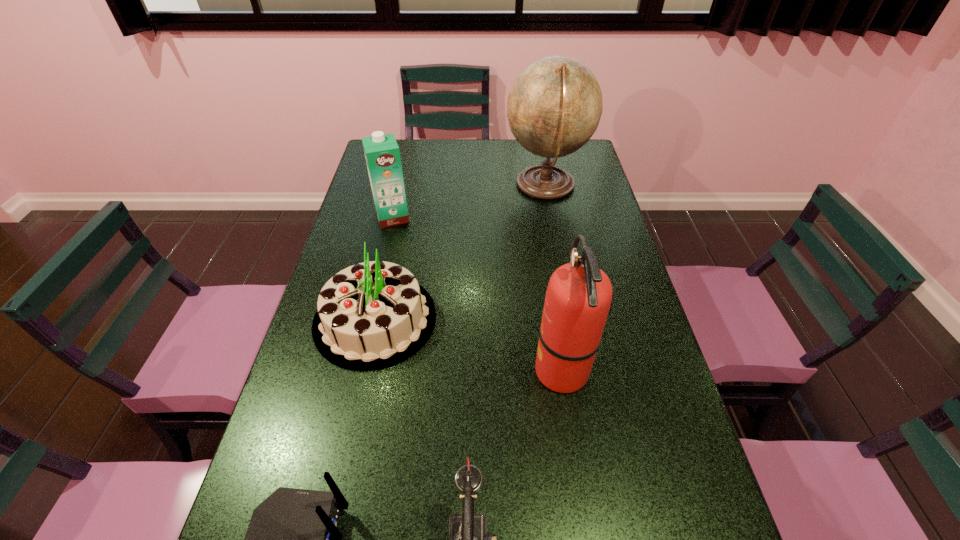
Where is `globe`? This screenshot has height=540, width=960. globe is located at coordinates (554, 107).

Locate an element on the screen. Image resolution: width=960 pixels, height=540 pixels. fire extinguisher is located at coordinates (578, 297).

This screenshot has width=960, height=540. In order to click on the third tallest object in this screenshot , I will do `click(382, 154)`.

Locate an element on the screen. The image size is (960, 540). birthday cake is located at coordinates (370, 316).

Where is `free location located on the front-facing side of the globe`? This screenshot has height=540, width=960. free location located on the front-facing side of the globe is located at coordinates (466, 185).

At what (x,y) coordinates should I click in order to perform the action: click on vacant space located on the front-facing side of the globe. Please return your answer as a coordinate pair (x, y). Looking at the image, I should click on (491, 185).

The height and width of the screenshot is (540, 960). Identify the location of free space located 0.390m on the front-facing side of the globe. (397, 185).

Where is `vacant space located on the side of the fire extinguisher with the nozzle and handle`? vacant space located on the side of the fire extinguisher with the nozzle and handle is located at coordinates (409, 370).

Locate an element on the screen. The image size is (960, 540). vacant space situated 0.290m on the side of the fire extinguisher with the nozzle and handle is located at coordinates (413, 370).

You are a GUI agent. You are given a task and a screenshot of the screen. Output one action in this format:
    pyautogui.click(x=<x>, y=<y>)
    Task: Click on the vacant space located on the side of the fire extinguisher with the nozzle and handle
    This screenshot has width=960, height=540.
    Given the screenshot: What is the action you would take?
    pyautogui.click(x=446, y=370)